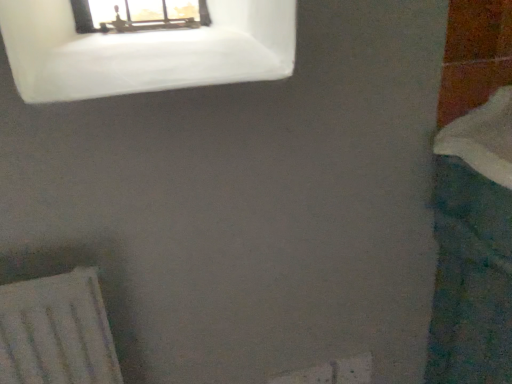
Question: Is teal fabric bath at right to the left or to the right of white frosted glass window at upper left in the image?

Choices:
 (A) right
 (B) left

Answer: (A)

Question: From a real-world perspective, is teal fabric bath at right physically located above or below white frosted glass window at upper left?

Choices:
 (A) above
 (B) below

Answer: (B)

Question: Based on their sizes in the image, would you say teal fabric bath at right is bigger or smaller than white frosted glass window at upper left?

Choices:
 (A) small
 (B) big

Answer: (B)

Question: Is white frosted glass window at upper left bigger or smaller than teal fabric bath at right?

Choices:
 (A) small
 (B) big

Answer: (A)

Question: Is white frosted glass window at upper left inside the boundaries of teal fabric bath at right, or outside?

Choices:
 (A) inside
 (B) outside

Answer: (B)

Question: Considering the positions of white frosted glass window at upper left and teal fabric bath at right in the image, is white frosted glass window at upper left taller or shorter than teal fabric bath at right?

Choices:
 (A) short
 (B) tall

Answer: (A)

Question: Considering their positions, is white frosted glass window at upper left located in front of or behind teal fabric bath at right?

Choices:
 (A) behind
 (B) front

Answer: (A)